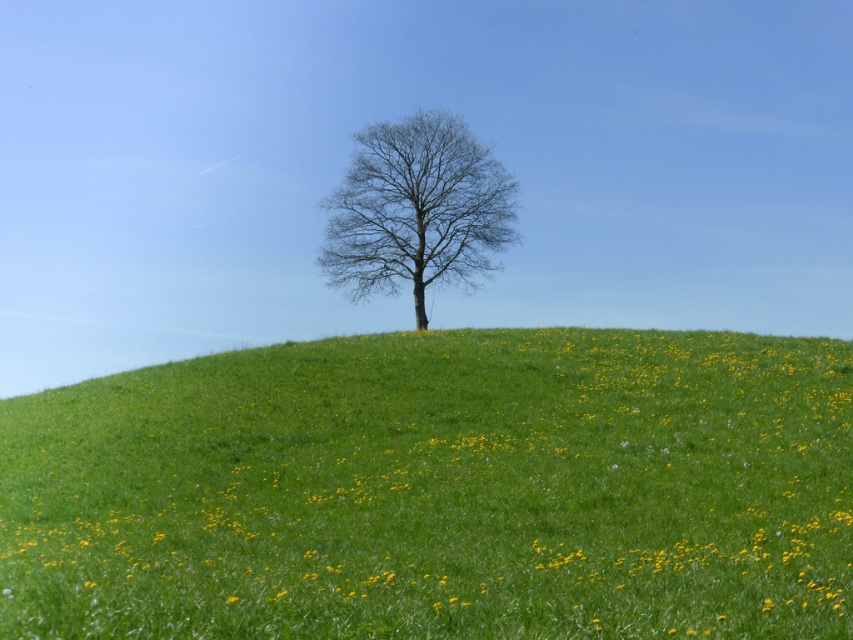
Question: Can you confirm if green grassy hillside at center is positioned to the right of bare branches at center?

Choices:
 (A) no
 (B) yes

Answer: (A)

Question: Which point is closer to the camera?

Choices:
 (A) (367, 152)
 (B) (715, 339)

Answer: (B)

Question: Can you confirm if green grassy hillside at center is wider than bare branches at center?

Choices:
 (A) no
 (B) yes

Answer: (B)

Question: Observing the image, what is the correct spatial positioning of green grassy hillside at center in reference to bare branches at center?

Choices:
 (A) left
 (B) right

Answer: (A)

Question: Which of the following is the closest to the observer?

Choices:
 (A) (463, 228)
 (B) (496, 472)

Answer: (B)